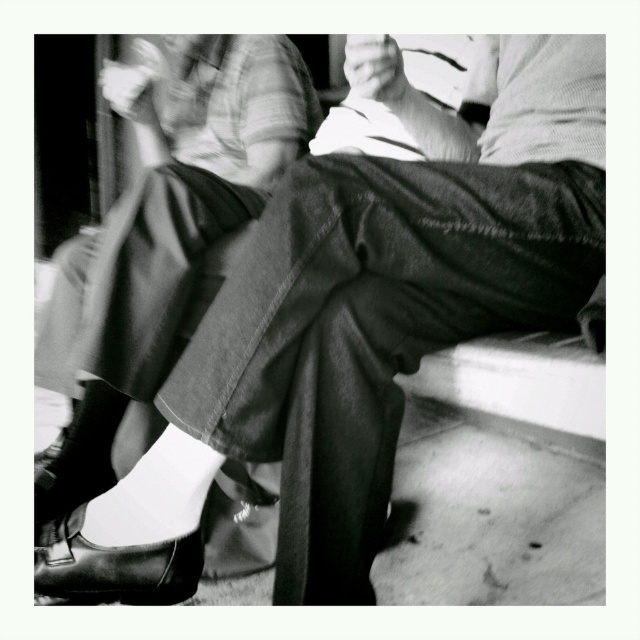
You are standing at the origin of a coordinate system placed at the bottom left corner of the image. You need to determine the relative positions of two points. Which point, point [195,157] or point [40,493], is closer to the bottom edge of the image?

Point [40,493] is closer to the bottom edge of the image because its y coordinate is smaller than that of point [195,157].